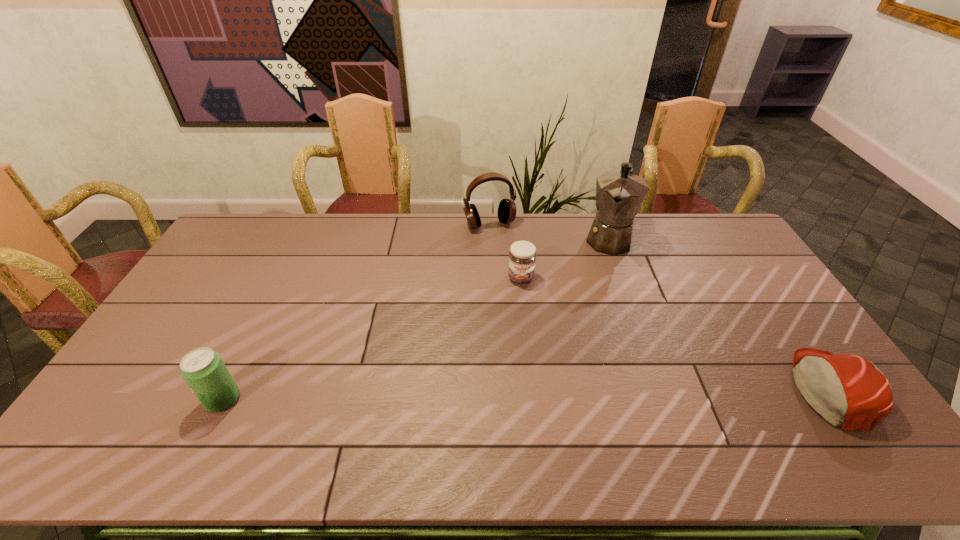
Locate an element on the screen. The height and width of the screenshot is (540, 960). blank region between the cap and the third shortest object is located at coordinates (527, 394).

What are the coordinates of `free space between the tallest object and the rightmost object` in the screenshot? It's located at (719, 314).

The width and height of the screenshot is (960, 540). What are the coordinates of `empty location between the third nearest object and the headset` in the screenshot? It's located at (505, 251).

This screenshot has width=960, height=540. I want to click on vacant space that is in between the leftmost object and the cap, so click(527, 394).

The height and width of the screenshot is (540, 960). I want to click on empty space between the cap and the tallest object, so click(719, 314).

Locate an element on the screen. vacant point located between the second tallest object and the coffeepot is located at coordinates (549, 231).

This screenshot has width=960, height=540. In order to click on unoccupied area between the headset and the tallest object in this screenshot , I will do `click(549, 231)`.

Where is `empty location between the third tallest object and the cap`? empty location between the third tallest object and the cap is located at coordinates (527, 394).

Identify which object is located as the third nearest to the third nearest object. Please provide its 2D coordinates. Your answer should be formatted as a tuple, i.e. [(x, y)], where the tuple contains the x and y coordinates of a point satisfying the conditions above.

[(848, 391)]

Where is `object that is the second closest one to the tallest object`? object that is the second closest one to the tallest object is located at coordinates (506, 213).